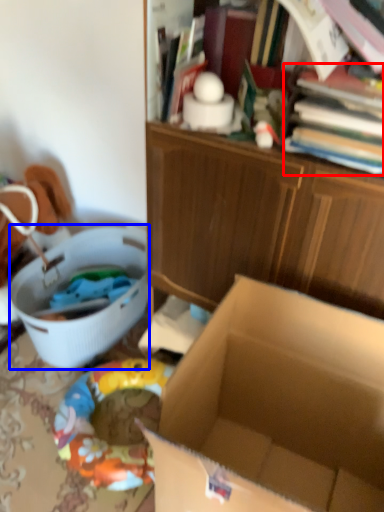
Question: Which point is further to the camera, book (highlighted by a red box) or laundry basket (highlighted by a blue box)?

Choices:
 (A) book
 (B) laundry basket

Answer: (B)